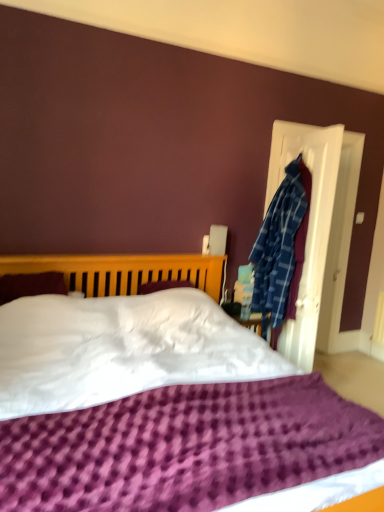
In order to face purple textured blanket at center, should I rotate leftwards or rightwards?

To align with it, rotate left about 0.813°.

What do you see at coordinates (121, 272) in the screenshot? I see `purple textured blanket at center` at bounding box center [121, 272].

Find the location of a particular element. The image size is (384, 512). purple textured blanket at center is located at coordinates (121, 272).

This screenshot has height=512, width=384. I want to click on purple textured blanket at center, so click(121, 272).